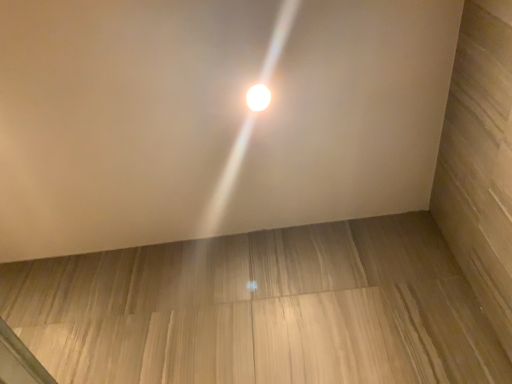
The width and height of the screenshot is (512, 384). I want to click on white glossy light bulb at upper center, so click(258, 97).

Describe the element at coordinates (258, 97) in the screenshot. I see `white glossy light bulb at upper center` at that location.

Identify the location of white glossy light bulb at upper center. (258, 97).